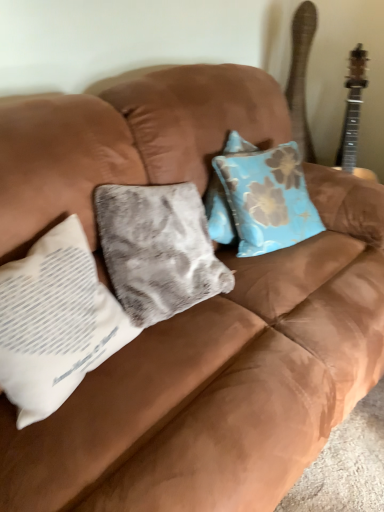
In order to face wooden acoustic guitar at upper right, should I rotate leftwards or rightwards?

Turn right by 22.468 degrees to look at wooden acoustic guitar at upper right.

Where is `wooden acoustic guitar at upper right`? The height and width of the screenshot is (512, 384). wooden acoustic guitar at upper right is located at coordinates (353, 115).

The height and width of the screenshot is (512, 384). Describe the element at coordinates (353, 115) in the screenshot. I see `wooden acoustic guitar at upper right` at that location.

The height and width of the screenshot is (512, 384). Identify the location of white fabric pillow at left. (55, 322).

The width and height of the screenshot is (384, 512). What do you see at coordinates (55, 322) in the screenshot? I see `white fabric pillow at left` at bounding box center [55, 322].

At what (x,y) coordinates should I click in order to perform the action: click on wooden acoustic guitar at upper right. Please return your answer as a coordinate pair (x, y). The width and height of the screenshot is (384, 512). Looking at the image, I should click on (353, 115).

Which object is positioned more to the left, wooden acoustic guitar at upper right or white fabric pillow at left?

white fabric pillow at left is more to the left.

Which object is further away from the camera taking this photo, wooden acoustic guitar at upper right or white fabric pillow at left?

wooden acoustic guitar at upper right is further away from the camera.

Is point (352, 91) positioned behind point (77, 318)?

Yes, point (352, 91) is behind point (77, 318).

From the image's perspective, is wooden acoustic guitar at upper right above white fabric pillow at left?

Indeed, from the image's perspective, wooden acoustic guitar at upper right is shown above white fabric pillow at left.

From a real-world perspective, is wooden acoustic guitar at upper right under white fabric pillow at left?

Actually, wooden acoustic guitar at upper right is physically above white fabric pillow at left in the real world.

Looking at this image, which of these two, wooden acoustic guitar at upper right or white fabric pillow at left, is thinner?

wooden acoustic guitar at upper right is thinner.

Can you confirm if wooden acoustic guitar at upper right is shorter than white fabric pillow at left?

In fact, wooden acoustic guitar at upper right may be taller than white fabric pillow at left.

Looking at this image, which of these two, wooden acoustic guitar at upper right or white fabric pillow at left, is bigger?

Bigger between the two is white fabric pillow at left.

Is white fabric pillow at left located within wooden acoustic guitar at upper right?

No.

Is wooden acoustic guitar at upper right next to white fabric pillow at left and touching it?

No, wooden acoustic guitar at upper right is not next to white fabric pillow at left.

Is wooden acoustic guitar at upper right turned away from white fabric pillow at left?

No.

Looking at this image, how different are the orientations of wooden acoustic guitar at upper right and white fabric pillow at left in degrees?

The angle between the facing direction of wooden acoustic guitar at upper right and the facing direction of white fabric pillow at left is 9.43 degrees.

Measure the distance from wooden acoustic guitar at upper right to white fabric pillow at left.

wooden acoustic guitar at upper right and white fabric pillow at left are 1.31 meters apart from each other.

You are a GUI agent. You are given a task and a screenshot of the screen. Output one action in this format:
    pyautogui.click(x=<x>, y=<y>)
    Task: Click on the pillow on the left of wooden acoustic guitar at upper right
    
    Given the screenshot: What is the action you would take?
    pyautogui.click(x=55, y=322)

Which object is positioned more to the left, white fabric pillow at left or wooden acoustic guitar at upper right?

white fabric pillow at left is more to the left.

Considering their positions, is white fabric pillow at left located in front of or behind wooden acoustic guitar at upper right?

Visually, white fabric pillow at left is located in front of wooden acoustic guitar at upper right.

Considering the positions of point (85, 355) and point (349, 157), is point (85, 355) closer or farther from the camera than point (349, 157)?

Point (85, 355) appears to be closer to the viewer than point (349, 157).

From the image's perspective, between white fabric pillow at left and wooden acoustic guitar at upper right, who is located below?

From the image's view, white fabric pillow at left is below.

From a real-world perspective, which object stands above the other?

wooden acoustic guitar at upper right.

Looking at their sizes, would you say white fabric pillow at left is wider or thinner than wooden acoustic guitar at upper right?

Considering their sizes, white fabric pillow at left looks broader than wooden acoustic guitar at upper right.

Is white fabric pillow at left taller than wooden acoustic guitar at upper right?

No.

Can you confirm if white fabric pillow at left is bigger than wooden acoustic guitar at upper right?

Yes.

Is white fabric pillow at left spatially inside wooden acoustic guitar at upper right, or outside of it?

white fabric pillow at left exists outside the volume of wooden acoustic guitar at upper right.

Is white fabric pillow at left next to wooden acoustic guitar at upper right?

No, white fabric pillow at left is not next to wooden acoustic guitar at upper right.

Is white fabric pillow at left positioned with its back to wooden acoustic guitar at upper right?

No, white fabric pillow at left's orientation is not away from wooden acoustic guitar at upper right.

Measure the distance from white fabric pillow at left to wooden acoustic guitar at upper right.

The distance of white fabric pillow at left from wooden acoustic guitar at upper right is 1.31 meters.

I want to click on guitar on the right of white fabric pillow at left, so click(353, 115).

Where is `guitar above the white fabric pillow at left (from a real-world perspective)`? The image size is (384, 512). guitar above the white fabric pillow at left (from a real-world perspective) is located at coordinates (353, 115).

At what (x,y) coordinates should I click in order to perform the action: click on pillow lying below the wooden acoustic guitar at upper right (from the image's perspective). Please return your answer as a coordinate pair (x, y). This screenshot has width=384, height=512. Looking at the image, I should click on click(x=55, y=322).